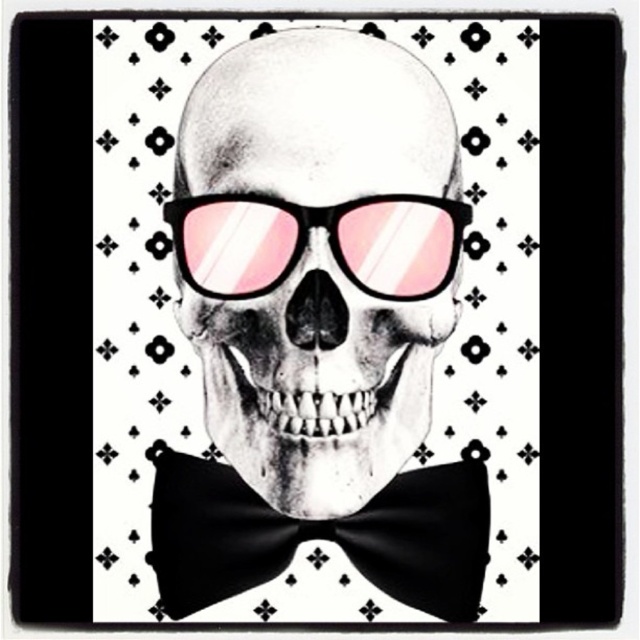
Question: Is black matte skull at center further to the viewer compared to pink reflective plastic goggles at center?

Choices:
 (A) no
 (B) yes

Answer: (B)

Question: Which of the following is the farthest from the observer?

Choices:
 (A) pink reflective plastic goggles at center
 (B) black matte skull at center

Answer: (B)

Question: Is black matte skull at center below pink reflective plastic goggles at center?

Choices:
 (A) yes
 (B) no

Answer: (A)

Question: Does black matte skull at center have a smaller size compared to pink reflective plastic goggles at center?

Choices:
 (A) yes
 (B) no

Answer: (B)

Question: Which of these objects is positioned closest to the pink reflective plastic goggles at center?

Choices:
 (A) black matte skull at center
 (B) black satin bow tie at center

Answer: (A)

Question: Which point is farther to the camera?

Choices:
 (A) (192, 513)
 (B) (298, 234)
 (C) (284, 486)

Answer: (A)